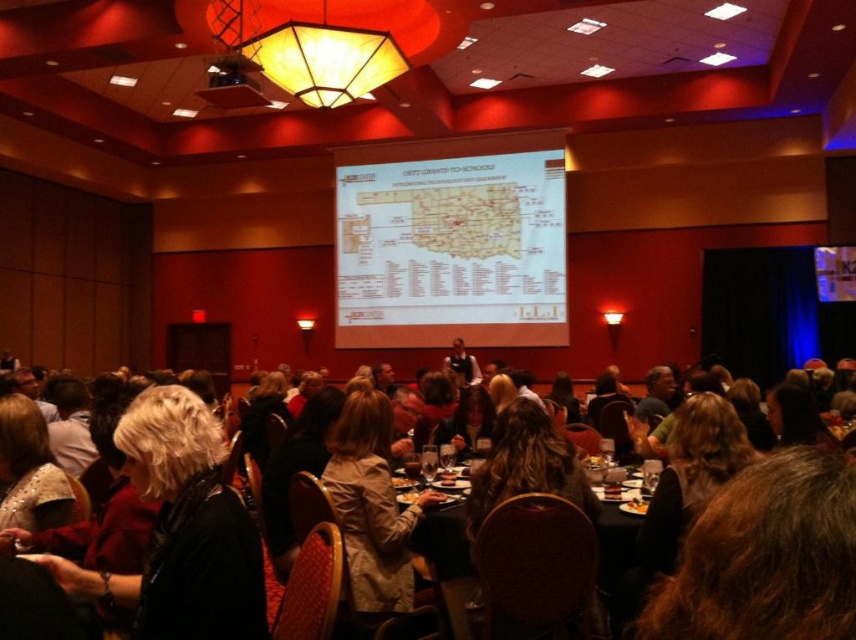
Question: Is brown leather chairs at center below blonde hair at left?

Choices:
 (A) yes
 (B) no

Answer: (B)

Question: Is brown leather chairs at center positioned at the back of light beige coat at center?

Choices:
 (A) yes
 (B) no

Answer: (B)

Question: Can you confirm if blonde hair at left is thinner than black plastic table at center?

Choices:
 (A) yes
 (B) no

Answer: (B)

Question: Which point is closer to the camera?

Choices:
 (A) (708, 563)
 (B) (223, 84)
 (C) (462, 616)

Answer: (A)

Question: Estimate the real-world distances between objects in this image. Which object is farther from the blonde hair at left?

Choices:
 (A) metallic projector at upper center
 (B) black plastic table at center
 (C) brown leather chairs at center

Answer: (A)

Question: Which of the following is the closest to the observer?

Choices:
 (A) (163, 516)
 (B) (476, 472)
 (C) (571, 499)
 (D) (339, 426)

Answer: (A)